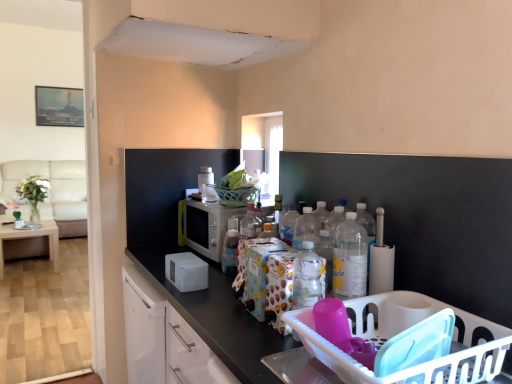
Question: Should I look upward or downward to see silver metallic microwave at center, positioned as the 2th appliance in top-to-bottom order?

Choices:
 (A) up
 (B) down

Answer: (B)

Question: In which direction should I rotate to look at translucent plastic bottle at center, which appears as the 1th bottle when viewed from the back?

Choices:
 (A) right
 (B) left

Answer: (B)

Question: Is transparent glass window at center to the left of white plastic toaster at upper center, which is counted as the first appliance, starting from the top, from the viewer's perspective?

Choices:
 (A) yes
 (B) no

Answer: (B)

Question: Is transparent glass window at center located outside white plastic toaster at upper center, which is counted as the first appliance, starting from the top?

Choices:
 (A) yes
 (B) no

Answer: (A)

Question: Does transparent glass window at center have a smaller size compared to white plastic toaster at upper center, which is counted as the first appliance, starting from the top?

Choices:
 (A) no
 (B) yes

Answer: (A)

Question: From the image's perspective, is transparent glass window at center on top of white plastic toaster at upper center, the 2th appliance from the bottom?

Choices:
 (A) yes
 (B) no

Answer: (A)

Question: Does transparent glass window at center have a lesser height compared to white plastic toaster at upper center, the 2th appliance from the bottom?

Choices:
 (A) no
 (B) yes

Answer: (A)

Question: Can you confirm if transparent glass window at center is wider than white plastic toaster at upper center, which is counted as the first appliance, starting from the top?

Choices:
 (A) no
 (B) yes

Answer: (B)

Question: Does white plastic toaster at upper center, the 2th appliance from the bottom, have a lesser width compared to beige fabric couch at left?

Choices:
 (A) yes
 (B) no

Answer: (A)

Question: Considering the relative positions of white plastic toaster at upper center, which is counted as the first appliance, starting from the top, and beige fabric couch at left in the image provided, is white plastic toaster at upper center, which is counted as the first appliance, starting from the top, behind beige fabric couch at left?

Choices:
 (A) no
 (B) yes

Answer: (A)

Question: Would you consider white plastic toaster at upper center, which is counted as the first appliance, starting from the top, to be distant from beige fabric couch at left?

Choices:
 (A) no
 (B) yes

Answer: (B)

Question: Does white plastic toaster at upper center, which is counted as the first appliance, starting from the top, lie in front of beige fabric couch at left?

Choices:
 (A) yes
 (B) no

Answer: (A)

Question: From the image's perspective, is white plastic toaster at upper center, which is counted as the first appliance, starting from the top, located beneath beige fabric couch at left?

Choices:
 (A) no
 (B) yes

Answer: (A)

Question: Is white plastic toaster at upper center, the 2th appliance from the bottom, bigger than beige fabric couch at left?

Choices:
 (A) yes
 (B) no

Answer: (B)

Question: Is white plastic toaster at upper center, which is counted as the first appliance, starting from the top, thinner than translucent plastic bottle at center, the 2th bottle when ordered from front to back?

Choices:
 (A) yes
 (B) no

Answer: (B)